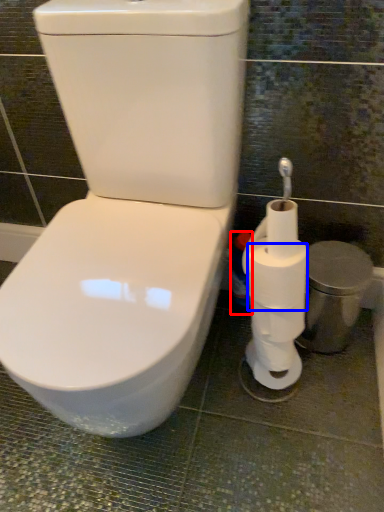
Question: Among these objects, which one is farthest to the camera, cleaning product (highlighted by a red box) or toilet paper (highlighted by a blue box)?

Choices:
 (A) cleaning product
 (B) toilet paper

Answer: (A)